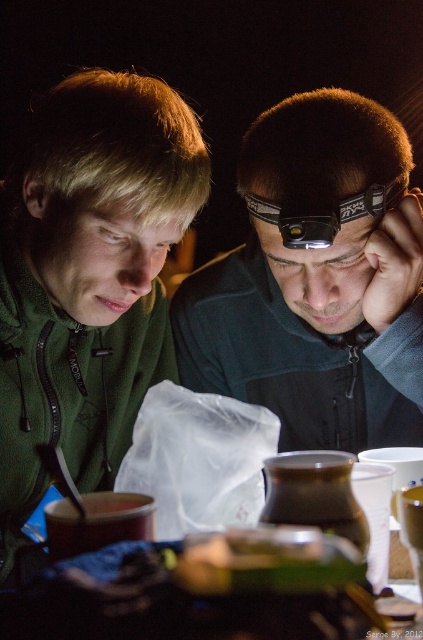
Question: Considering the real-world distances, which object is closest to the matte black headlamp at center?

Choices:
 (A) green matte hoodie at upper left
 (B) green matte sandwich at center
 (C) black plastic goggles at center

Answer: (C)

Question: Is matte black headlamp at center wider than green matte sandwich at center?

Choices:
 (A) no
 (B) yes

Answer: (B)

Question: Observing the image, what is the correct spatial positioning of green matte hoodie at upper left in reference to matte black headlamp at center?

Choices:
 (A) below
 (B) above

Answer: (A)

Question: Which object is the farthest from the black plastic goggles at center?

Choices:
 (A) matte black headlamp at center
 (B) green matte sandwich at center

Answer: (B)

Question: Among these points, which one is farthest from the camera?

Choices:
 (A) (420, 273)
 (B) (329, 579)
 (C) (107, 144)

Answer: (A)

Question: Does matte black headlamp at center appear under black plastic goggles at center?

Choices:
 (A) no
 (B) yes

Answer: (B)